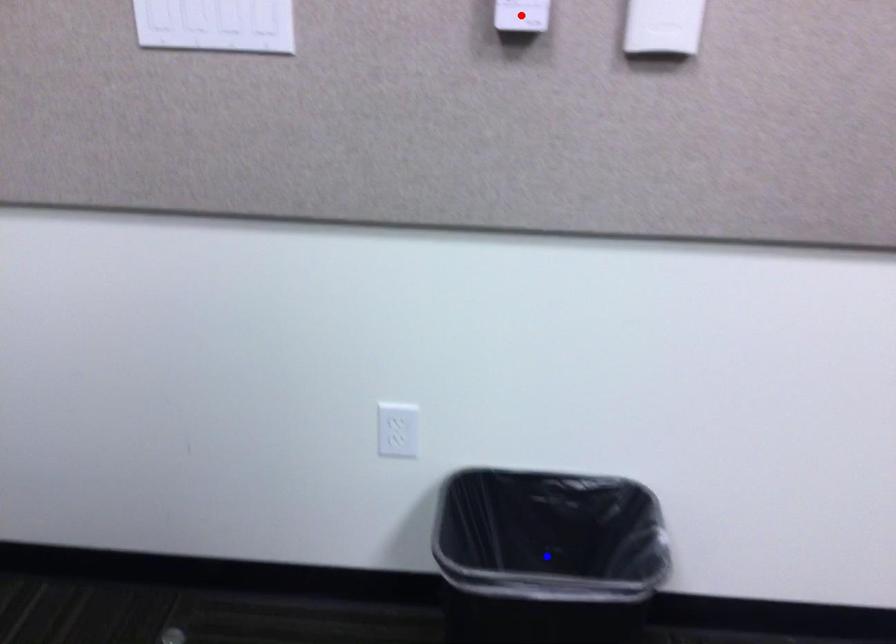
Question: Which of the two points in the image is closer to the camera?

Choices:
 (A) Blue point is closer.
 (B) Red point is closer.

Answer: (B)